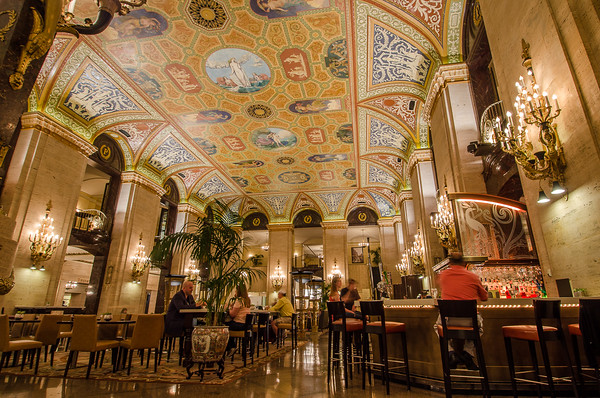
What are the coordinates of `ceiling` in the screenshot? It's located at (312, 71).